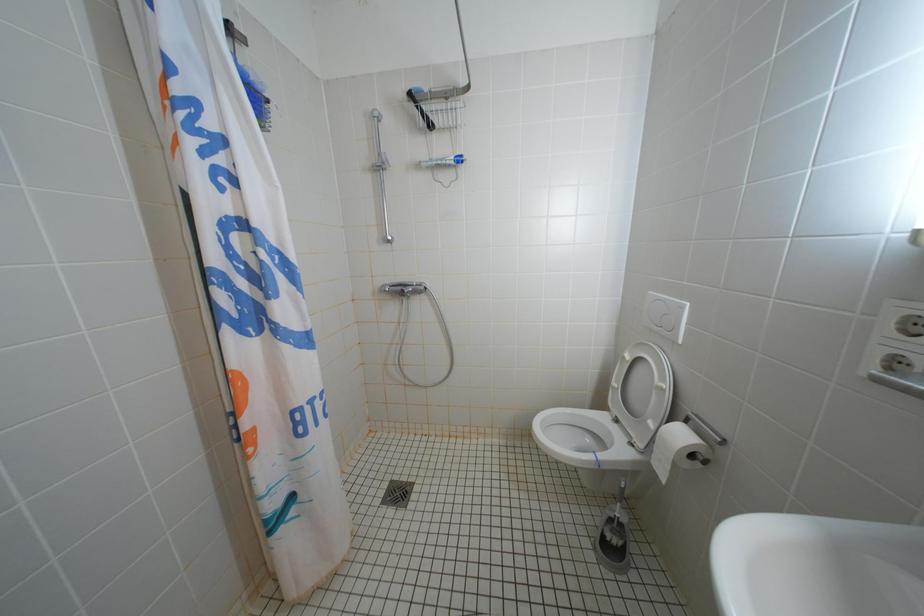
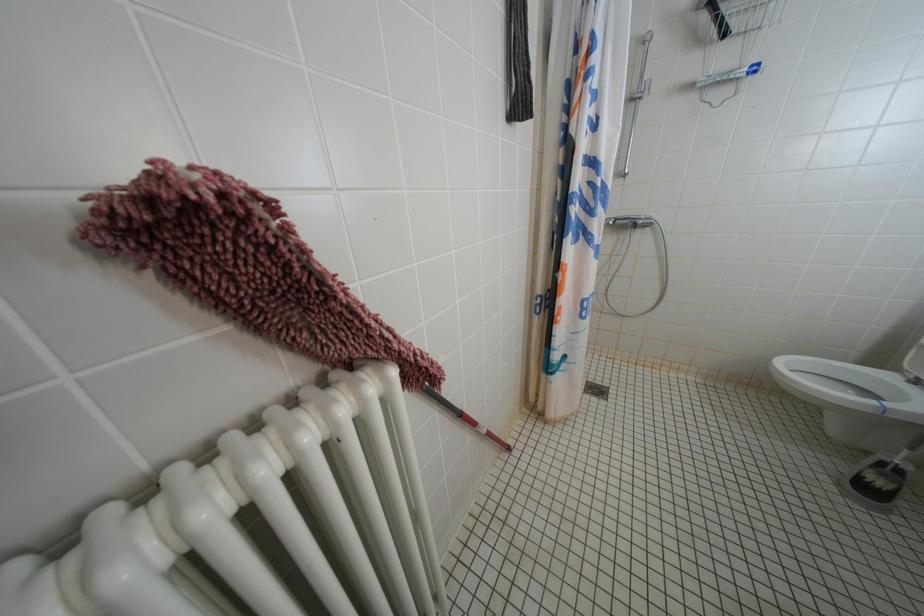
Which direction would the cameraman need to move to produce the second image?

The cameraman moved toward left, backward.